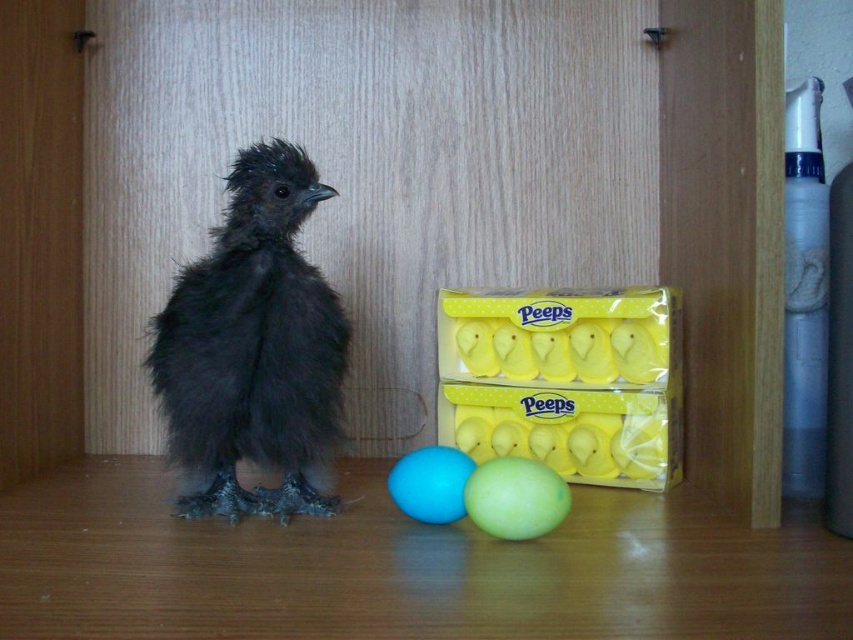
Is green matte egg at center positioned before blue rubber egg at center?

Yes, green matte egg at center is in front of blue rubber egg at center.

Between green matte egg at center and blue rubber egg at center, which one is positioned higher?

green matte egg at center is above.

The width and height of the screenshot is (853, 640). What do you see at coordinates (515, 499) in the screenshot?
I see `green matte egg at center` at bounding box center [515, 499].

Where is `green matte egg at center`? This screenshot has width=853, height=640. green matte egg at center is located at coordinates (515, 499).

Does black fluffy bird at left have a greater height compared to yellow matte peeps box at center?

Yes, black fluffy bird at left is taller than yellow matte peeps box at center.

Can you confirm if black fluffy bird at left is smaller than yellow matte peeps box at center?

Actually, black fluffy bird at left might be larger than yellow matte peeps box at center.

Based on the photo, who is more forward, (231, 180) or (463, 296)?

Point (231, 180) is in front.

I want to click on black fluffy bird at left, so click(254, 348).

Is black fluffy bird at left above blue rubber egg at center?

Yes.

Is black fluffy bird at left thinner than blue rubber egg at center?

No.

Describe the element at coordinates (254, 348) in the screenshot. I see `black fluffy bird at left` at that location.

Locate an element on the screen. black fluffy bird at left is located at coordinates [254, 348].